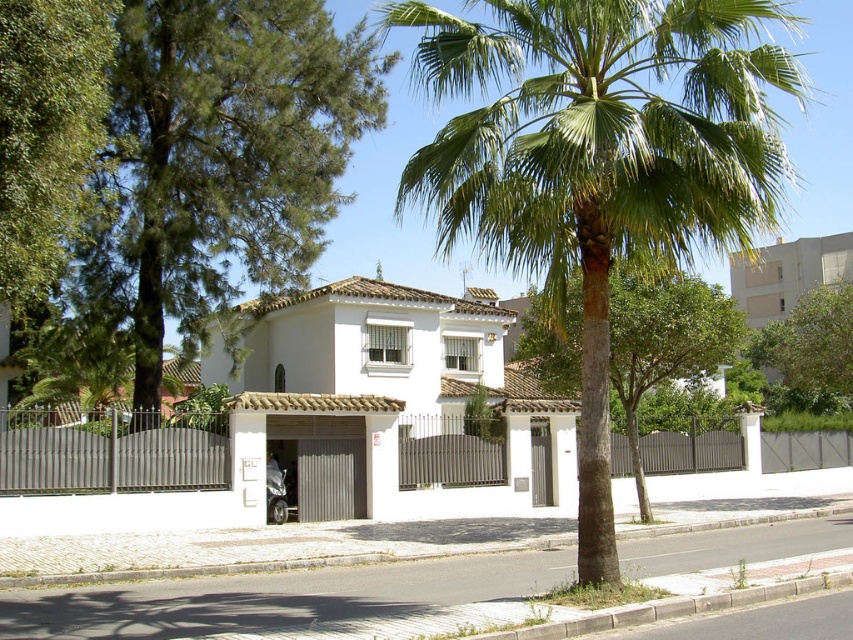
Question: Which point is farther from the camera taking this photo?

Choices:
 (A) 566,192
 (B) 639,368

Answer: (B)

Question: Can you confirm if green leafy palm tree at center is thinner than green leafy tree at center?

Choices:
 (A) yes
 (B) no

Answer: (B)

Question: Is the position of green leafy palm tree at center less distant than that of green leafy tree at center?

Choices:
 (A) no
 (B) yes

Answer: (B)

Question: Can you confirm if green leafy palm tree at center is smaller than green leafy tree at center?

Choices:
 (A) no
 (B) yes

Answer: (A)

Question: Which of the following is the farthest from the observer?

Choices:
 (A) (608, 330)
 (B) (532, 40)

Answer: (A)